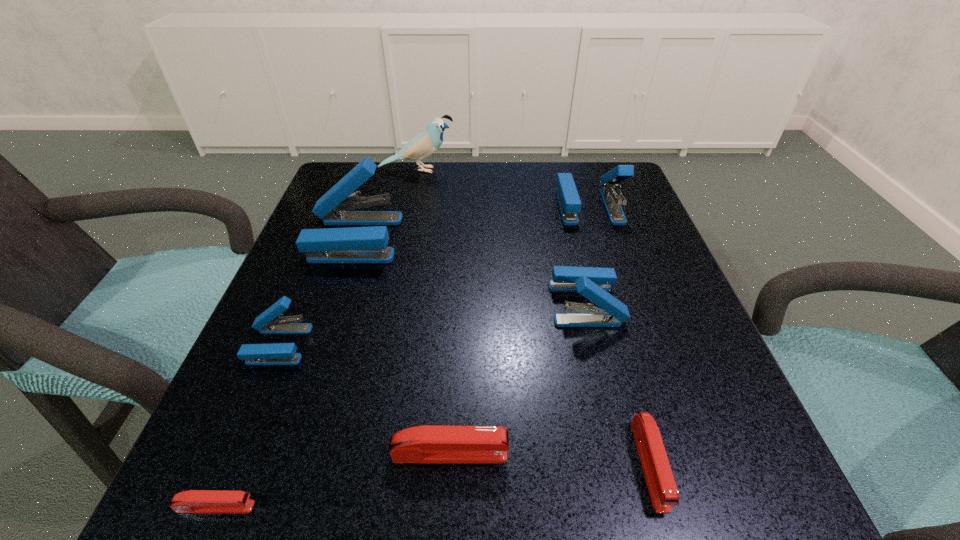
Find the location of a particular element. vacant space situated 0.150m on the front-facing side of the third shortest object is located at coordinates (622, 454).

Image resolution: width=960 pixels, height=540 pixels. I want to click on vacant space located 0.330m on the front-facing side of the shortest object, so click(x=529, y=507).

Identify the location of bird positioned at the far edge. (427, 142).

Locate an element on the screen. bird that is at the left edge is located at coordinates (427, 142).

Identify the location of bird that is positioned at the far left corner. (427, 142).

Image resolution: width=960 pixels, height=540 pixels. I want to click on stapler located in the far left corner section of the desktop, so click(x=354, y=244).

Identify the location of object that is at the near left corner. This screenshot has height=540, width=960. (193, 501).

Locate an element on the screen. Image resolution: width=960 pixels, height=540 pixels. object positioned at the far right corner is located at coordinates (569, 201).

Identify the location of object at the near right corner. The width and height of the screenshot is (960, 540). (662, 488).

The image size is (960, 540). In the image, there is a desktop. What are the coordinates of `free region at the far edge` in the screenshot? It's located at (434, 171).